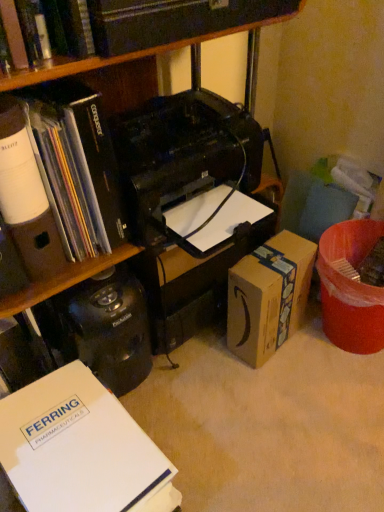
This screenshot has height=512, width=384. In order to click on empty space that is to the right of white paper at lower left, arranged as the 3th book when viewed from the top in this screenshot , I will do `click(219, 453)`.